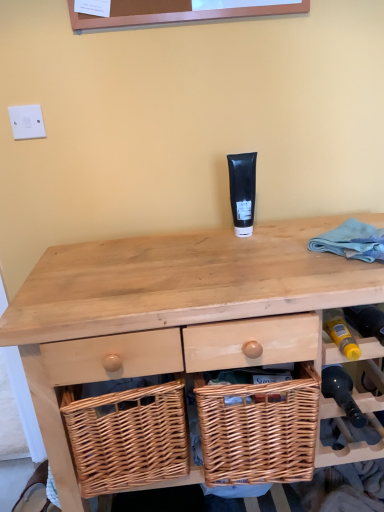
Find the location of `blank space to the left of black matte tube at center`. blank space to the left of black matte tube at center is located at coordinates (196, 242).